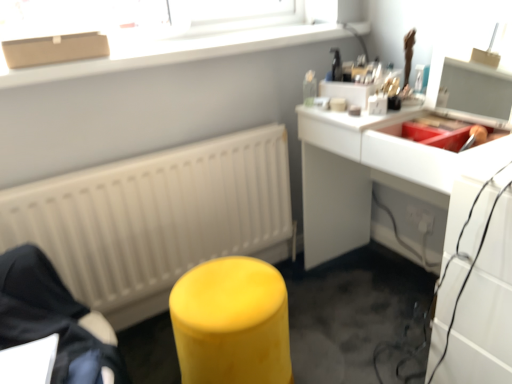
Describe the element at coordinates (53, 319) in the screenshot. I see `matte yellow stool at lower left, the 2th furniture from the right` at that location.

I want to click on matte white window sill at upper center, so click(x=174, y=50).

What do you see at coordinates (420, 219) in the screenshot? I see `white plastic electric outlet at lower right` at bounding box center [420, 219].

What is the approximate width of white glossy desk at upper right?

The width of white glossy desk at upper right is 20.96 inches.

At what (x,y) coordinates should I click in order to perform the action: click on matte yellow stool at lower left, which appears as the first furniture when viewed from the left. Please return your answer as a coordinate pair (x, y). The image size is (512, 384). Looking at the image, I should click on (53, 319).

Does matte white window sill at upper center have a larger size compared to matte white radiator at center?

Actually, matte white window sill at upper center might be smaller than matte white radiator at center.

Does matte white window sill at upper center come behind matte white radiator at center?

No, it is in front of matte white radiator at center.

Image resolution: width=512 pixels, height=384 pixels. What are the coordinates of `radiator behind the matte white window sill at upper center` in the screenshot? It's located at (156, 218).

Is matte white window sill at upper center not close to white plastic electric outlet at lower right?

Yes.

How different are the orientations of matte white window sill at upper center and white plastic electric outlet at lower right in degrees?

They differ by 89.6 degrees in their facing directions.

Based on the photo, is matte white window sill at upper center to the left or to the right of white plastic electric outlet at lower right in the image?

matte white window sill at upper center is positioned on white plastic electric outlet at lower right's left side.

Is matte white window sill at upper center in front of white plastic electric outlet at lower right?

Yes, matte white window sill at upper center is in front of white plastic electric outlet at lower right.

Is white plastic electric outlet at lower right shorter than white glossy desk at upper right?

Yes, white plastic electric outlet at lower right is shorter than white glossy desk at upper right.

Which object is positioned more to the right, white plastic electric outlet at lower right or white glossy desk at upper right?

white plastic electric outlet at lower right is more to the right.

Which object is closer to the camera taking this photo, white plastic electric outlet at lower right or white glossy desk at upper right?

white glossy desk at upper right.

Which is farther from the camera, (x=425, y=231) or (x=495, y=216)?

The point (x=425, y=231) is behind.

Find the location of a particular element. The width and height of the screenshot is (512, 384). computer desk that appears in front of the matte white radiator at center is located at coordinates (361, 175).

Is white glossy desk at upper right smaller than matte white radiator at center?

Incorrect, white glossy desk at upper right is not smaller in size than matte white radiator at center.

Can you see white glossy desk at upper right touching matte white radiator at center?

white glossy desk at upper right and matte white radiator at center are not in contact.

Considering the positions of objects white glossy desk at upper right and matte white radiator at center in the image provided, who is more to the left, white glossy desk at upper right or matte white radiator at center?

From the viewer's perspective, matte white radiator at center appears more on the left side.

Is white plastic electric outlet at lower right facing towards matte yellow stool at lower left, which appears as the first furniture when viewed from the left?

Yes, white plastic electric outlet at lower right faces towards matte yellow stool at lower left, which appears as the first furniture when viewed from the left.

Is white plastic electric outlet at lower right not within matte yellow stool at lower left, the 2th furniture from the right?

Yes, white plastic electric outlet at lower right is not within matte yellow stool at lower left, the 2th furniture from the right.

Considering the positions of point (428, 213) and point (4, 316), is point (428, 213) closer or farther from the camera than point (4, 316)?

Clearly, point (428, 213) is more distant from the camera than point (4, 316).

In the scene shown: From a real-world perspective, is matte white window sill at upper center below white glossy desk at upper right?

No, from a real-world perspective, matte white window sill at upper center is not under white glossy desk at upper right.

Between matte white window sill at upper center and white glossy desk at upper right, which one has larger size?

Bigger between the two is white glossy desk at upper right.

Is matte white window sill at upper center at the right side of white glossy desk at upper right?

No.

Is white plastic electric outlet at lower right taller or shorter than matte yellow stool at center, acting as the 1th furniture starting from the right?

white plastic electric outlet at lower right is shorter than matte yellow stool at center, acting as the 1th furniture starting from the right.

Between white plastic electric outlet at lower right and matte yellow stool at center, the second furniture in the left-to-right sequence, which one is positioned in front?

matte yellow stool at center, the second furniture in the left-to-right sequence, is more forward.

Does white plastic electric outlet at lower right have a lesser width compared to matte yellow stool at center, acting as the 1th furniture starting from the right?

Correct, the width of white plastic electric outlet at lower right is less than that of matte yellow stool at center, acting as the 1th furniture starting from the right.

Identify the location of window lying on the right of matte white radiator at center. The image size is (512, 384). 174,50.

Where is `window on the left side of white plastic electric outlet at lower right`? window on the left side of white plastic electric outlet at lower right is located at coordinates (174, 50).

Which object lies nearer to the anchor point matte white window sill at upper center, white glossy desk at upper right or matte yellow stool at lower left, which appears as the first furniture when viewed from the left?

The object closer to matte white window sill at upper center is white glossy desk at upper right.

From the image, which object appears to be farther from white plastic electric outlet at lower right, matte yellow stool at center, acting as the 1th furniture starting from the right, or white glossy desk at upper right?

The object further to white plastic electric outlet at lower right is matte yellow stool at center, acting as the 1th furniture starting from the right.

When comparing their distances from matte yellow stool at lower left, the 2th furniture from the right, does matte yellow stool at center, the second furniture in the left-to-right sequence, or matte white window sill at upper center seem further?

matte white window sill at upper center is positioned further to the anchor matte yellow stool at lower left, the 2th furniture from the right.

When comparing their distances from matte white window sill at upper center, does matte white radiator at center or matte yellow stool at center, acting as the 1th furniture starting from the right, seem further?

Based on the image, matte yellow stool at center, acting as the 1th furniture starting from the right, appears to be further to matte white window sill at upper center.

Estimate the real-world distances between objects in this image. Which object is closer to matte white window sill at upper center, matte yellow stool at lower left, which appears as the first furniture when viewed from the left, or white plastic electric outlet at lower right?

Based on the image, matte yellow stool at lower left, which appears as the first furniture when viewed from the left, appears to be nearer to matte white window sill at upper center.

Based on their spatial positions, is white glossy desk at upper right or matte yellow stool at center, the second furniture in the left-to-right sequence, closer to matte yellow stool at lower left, the 2th furniture from the right?

Based on the image, matte yellow stool at center, the second furniture in the left-to-right sequence, appears to be nearer to matte yellow stool at lower left, the 2th furniture from the right.

From the image, which object appears to be nearer to matte white radiator at center, white glossy desk at upper right or matte white window sill at upper center?

white glossy desk at upper right.

Estimate the real-world distances between objects in this image. Which object is further from matte yellow stool at center, acting as the 1th furniture starting from the right, white glossy desk at upper right or matte yellow stool at lower left, which appears as the first furniture when viewed from the left?

white glossy desk at upper right is further to matte yellow stool at center, acting as the 1th furniture starting from the right.

What are the coordinates of `computer desk between matte white radiator at center and white plastic electric outlet at lower right` in the screenshot? It's located at (361, 175).

The image size is (512, 384). I want to click on furniture located between matte yellow stool at lower left, which appears as the first furniture when viewed from the left, and white plastic electric outlet at lower right in the left-right direction, so click(232, 323).

I want to click on computer desk between matte white window sill at upper center and white plastic electric outlet at lower right, so pyautogui.click(x=361, y=175).

Identify the location of radiator situated between matte yellow stool at lower left, which appears as the first furniture when viewed from the left, and white plastic electric outlet at lower right from left to right. (156, 218).